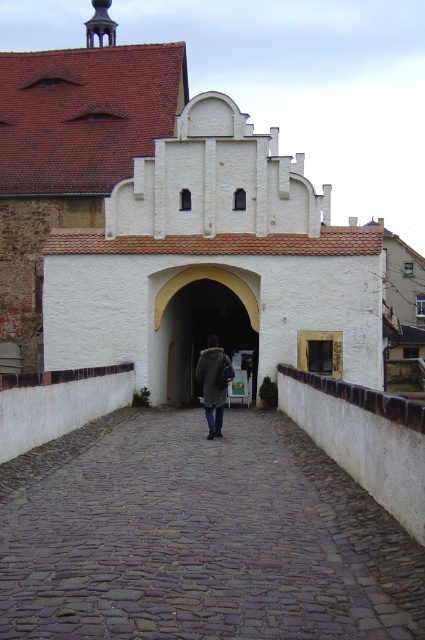
Question: Does cobblestone path at center come in front of dark gray wool coat at center?

Choices:
 (A) yes
 (B) no

Answer: (A)

Question: In this image, where is cobblestone path at center located relative to dark gray wool coat at center?

Choices:
 (A) left
 (B) right

Answer: (B)

Question: Is cobblestone path at center above smooth white archway at center?

Choices:
 (A) yes
 (B) no

Answer: (B)

Question: Which point is farther from the camera taking this photo?

Choices:
 (A) (348, 531)
 (B) (226, 358)
 (C) (192, 362)

Answer: (C)

Question: Estimate the real-world distances between objects in this image. Which object is farther from the smooth white archway at center?

Choices:
 (A) dark gray wool coat at center
 (B) cobblestone path at center

Answer: (B)

Question: Which point is closer to the camera?

Choices:
 (A) (384, 612)
 (B) (257, 321)

Answer: (A)